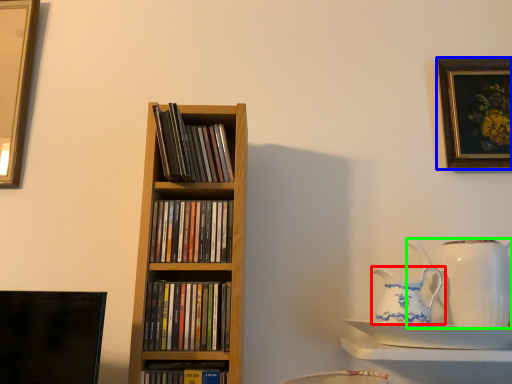
Question: Which object is positioned closest to jug (highlighted by a red box)? Select from picture frame (highlighted by a blue box) and jug (highlighted by a green box).

Choices:
 (A) picture frame
 (B) jug

Answer: (B)